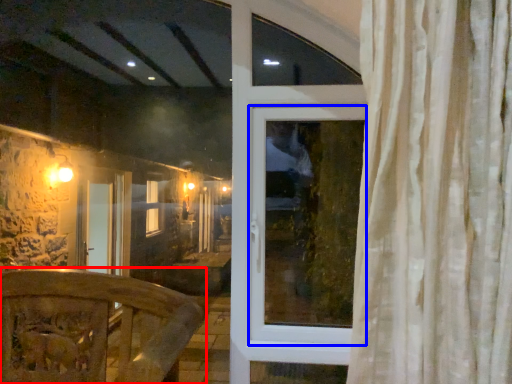
Question: Among these objects, which one is nearest to the camera, furniture (highlighted by a red box) or window (highlighted by a blue box)?

Choices:
 (A) furniture
 (B) window

Answer: (A)